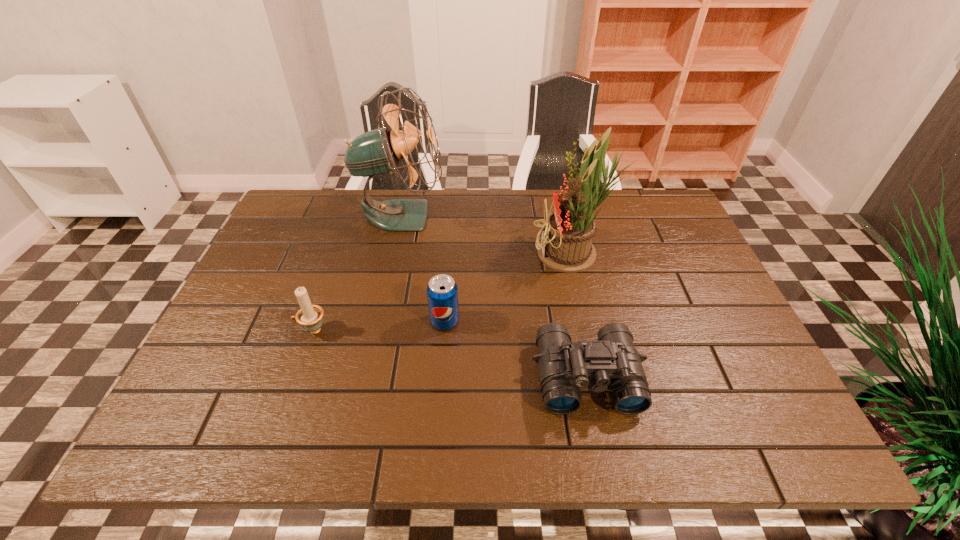
Identify the location of vacant space located 0.070m on the handle side of the candle_holder. (266, 330).

This screenshot has width=960, height=540. In order to click on free space located 0.070m on the handle side of the candle_holder in this screenshot , I will do `click(266, 330)`.

In order to click on vacant space located 0.130m on the left of the pop soda in this screenshot , I will do `click(374, 322)`.

Where is `fan located in the far edge section of the desktop`? The width and height of the screenshot is (960, 540). fan located in the far edge section of the desktop is located at coordinates (378, 151).

What are the coordinates of `flower arrangement located in the far edge section of the desktop` in the screenshot? It's located at (565, 246).

Locate an element on the screen. object that is positioned at the near edge is located at coordinates [x=612, y=362].

I want to click on free location at the near edge of the desktop, so click(604, 414).

Locate an element on the screen. free point at the left edge is located at coordinates (268, 370).

This screenshot has width=960, height=540. Find the location of `vacant position at the right edge of the desktop`. vacant position at the right edge of the desktop is located at coordinates (697, 314).

Locate an element on the screen. vacant space at the far left corner is located at coordinates (300, 222).